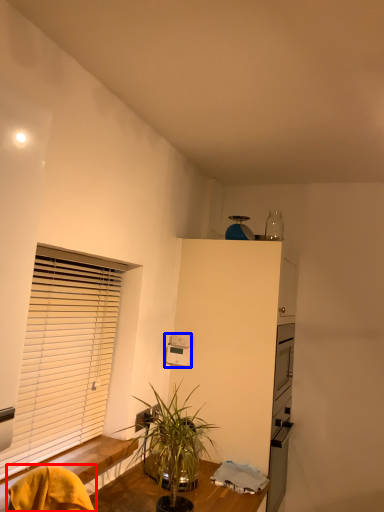
Question: Which of the following is the farthest to the observer, swivel chair (highlighted by a red box) or appliance (highlighted by a blue box)?

Choices:
 (A) swivel chair
 (B) appliance

Answer: (B)